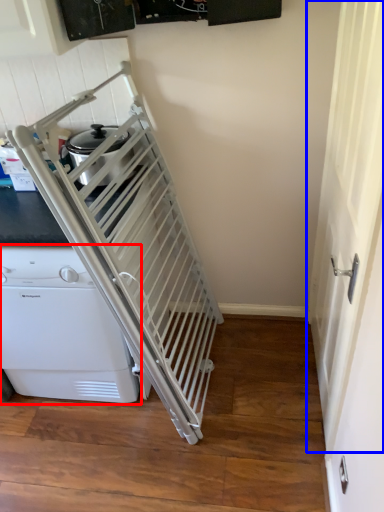
Question: Among these objects, which one is farthest to the camera, home appliance (highlighted by a red box) or screen door (highlighted by a blue box)?

Choices:
 (A) home appliance
 (B) screen door

Answer: (A)